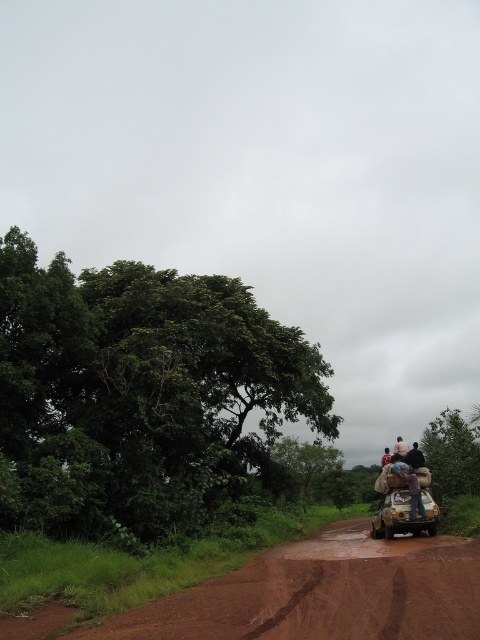
Question: Which object is the closest to the blue denim jeans at center?

Choices:
 (A) pink fabric at upper right
 (B) green leafy tree at left
 (C) dark blue shirt at upper right

Answer: (A)

Question: Among these objects, which one is nearest to the camera?

Choices:
 (A) blue denim jeans at center
 (B) brown dirt track at lower right
 (C) green leafy tree at left
 (D) pink fabric at upper right

Answer: (B)

Question: From the image, what is the correct spatial relationship of brown dirt track at lower right in relation to blue denim jeans at center?

Choices:
 (A) above
 (B) below

Answer: (B)

Question: Which point is farther to the camera?

Choices:
 (A) (x=388, y=451)
 (B) (x=456, y=420)
 (C) (x=261, y=333)
 (D) (x=409, y=468)

Answer: (A)

Question: Is brown dirt track at lower right further to the viewer compared to blue denim jeans at center?

Choices:
 (A) yes
 (B) no

Answer: (B)

Question: In this image, where is blue denim jeans at center located relative to dark blue shirt at upper right?

Choices:
 (A) right
 (B) left

Answer: (B)